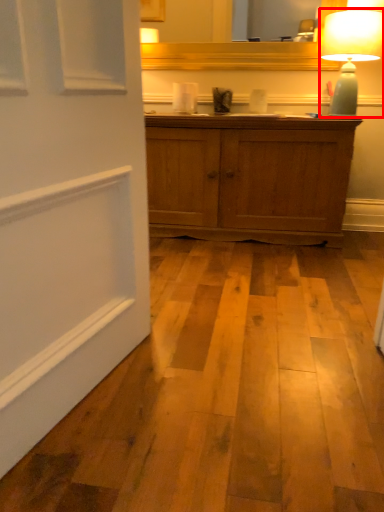
Question: Observing the image, what is the correct spatial positioning of table lamp (annotated by the red box) in reference to mirror?

Choices:
 (A) left
 (B) right

Answer: (B)